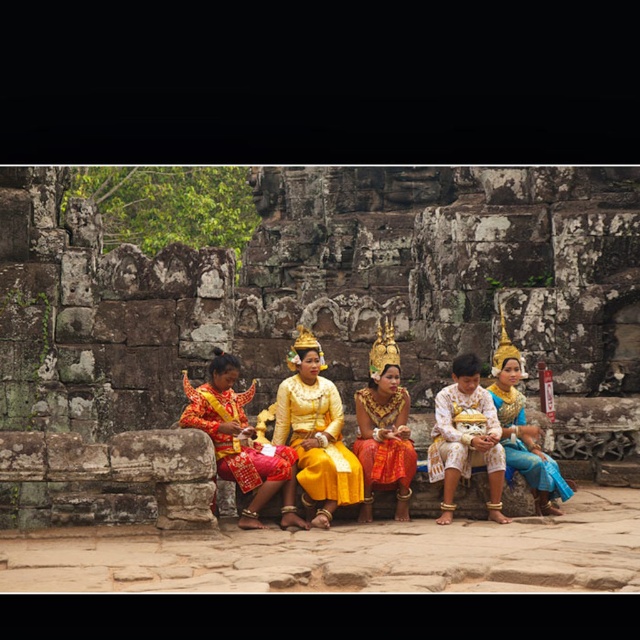
Question: Does golden silk dress at center have a lesser width compared to white satin costume at center?

Choices:
 (A) no
 (B) yes

Answer: (A)

Question: Among these objects, which one is nearest to the camera?

Choices:
 (A) golden silk dress at center
 (B) yellow satin dress at center
 (C) shiny red fabric at center

Answer: (C)

Question: Does golden silk dress at center have a smaller size compared to white satin costume at center?

Choices:
 (A) yes
 (B) no

Answer: (B)

Question: Which point is closer to the camera taking this photo?

Choices:
 (A) (451, 448)
 (B) (294, 458)

Answer: (B)

Question: Does golden silk dress at center have a larger size compared to white satin costume at center?

Choices:
 (A) yes
 (B) no

Answer: (A)

Question: Which is farther from the matte gold headpiece at center?

Choices:
 (A) shiny red fabric at center
 (B) white satin costume at center
 (C) golden silk dress at center

Answer: (A)